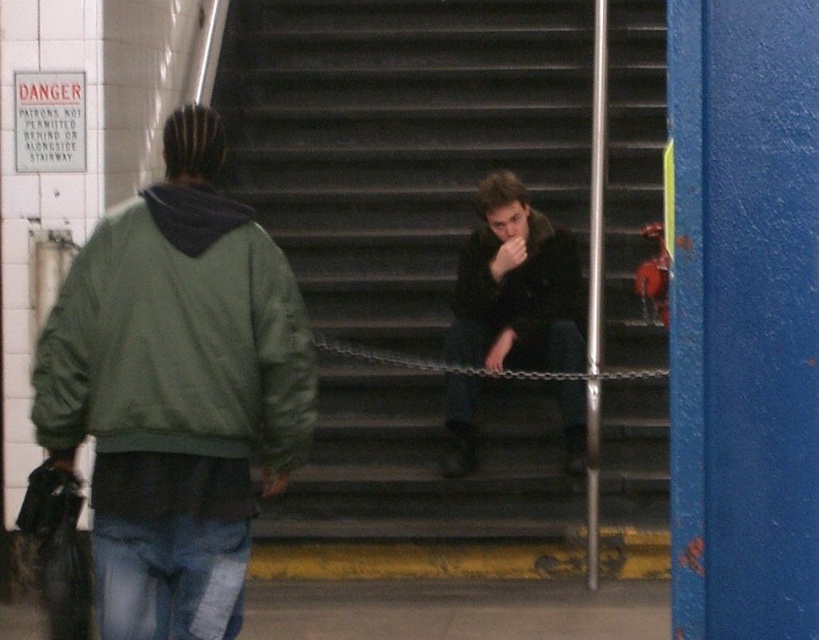
You are a delivery person carrying a package that is 20 inches wide. You need to place it between the dark gray concrete stairs at center and the dark brown leather jacket at center. Is there enough space for the package?

The distance between the dark gray concrete stairs at center and the dark brown leather jacket at center is 31.35 inches. Since the package is 20 inches wide, there is sufficient space to place it between them.

You are standing at the entrance of the subway station and see the green matte jacket at left and the dark brown leather jacket at center. Which person is closer to you?

The green matte jacket at left is closer to you because it is in front of the dark brown leather jacket at center.

You are standing at the camera position and want to reach the point at coordinates (156, 296). Is this point within the first 3 meters of the camera?

The distance of point (156, 296) from the camera is 3.62 meters, so it is beyond the first 3 meters.